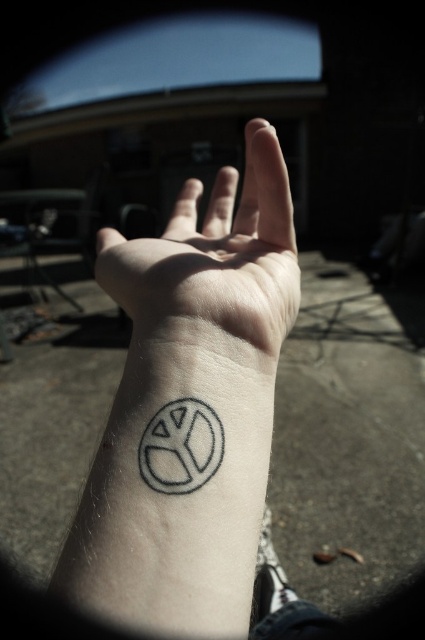
Is black ink tattoo at lower left to the left of pale skin at center from the viewer's perspective?

No, black ink tattoo at lower left is not to the left of pale skin at center.

This screenshot has height=640, width=425. Find the location of `black ink tattoo at lower left`. black ink tattoo at lower left is located at coordinates (189, 408).

Is point (249, 458) farther from viewer compared to point (104, 269)?

No, (249, 458) is closer to viewer.

Locate an element on the screen. black ink tattoo at lower left is located at coordinates (189, 408).

Who is more forward, (172, 227) or (201, 472)?

Point (201, 472)

Is pale skin at center thinner than gray ink peace sign at lower center?

No, pale skin at center is not thinner than gray ink peace sign at lower center.

Image resolution: width=425 pixels, height=640 pixels. What are the coordinates of `pale skin at center` in the screenshot? It's located at (215, 256).

Locate an element on the screen. This screenshot has width=425, height=640. pale skin at center is located at coordinates (215, 256).

Which of these two, black ink tattoo at lower left or gray ink peace sign at lower center, stands taller?

black ink tattoo at lower left is taller.

Describe the element at coordinates (189, 408) in the screenshot. Image resolution: width=425 pixels, height=640 pixels. I see `black ink tattoo at lower left` at that location.

The height and width of the screenshot is (640, 425). What are the coordinates of `black ink tattoo at lower left` in the screenshot? It's located at (189, 408).

In order to click on black ink tattoo at lower left in this screenshot , I will do `click(189, 408)`.